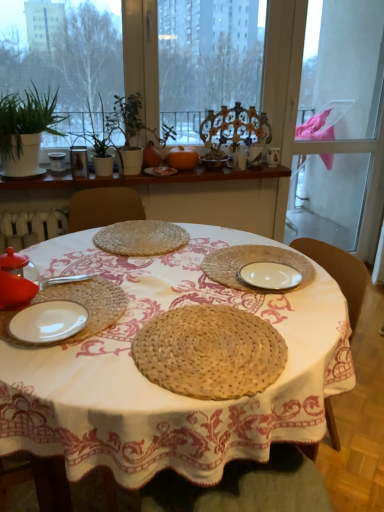
At what (x,y) coordinates should I click in order to perform the action: click on vacant area on the back side of matte glass teapot at left, the fourth tableware viewed from the right. Please return your answer as a coordinate pair (x, y). Image resolution: width=384 pixels, height=512 pixels. Looking at the image, I should click on (59, 275).